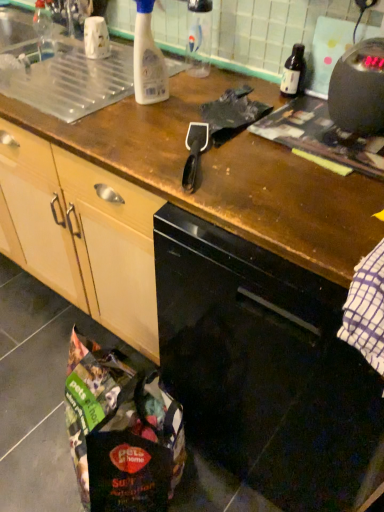
Image resolution: width=384 pixels, height=512 pixels. Identify the location of free space to the back side of black plastic spatula at center. (173, 126).